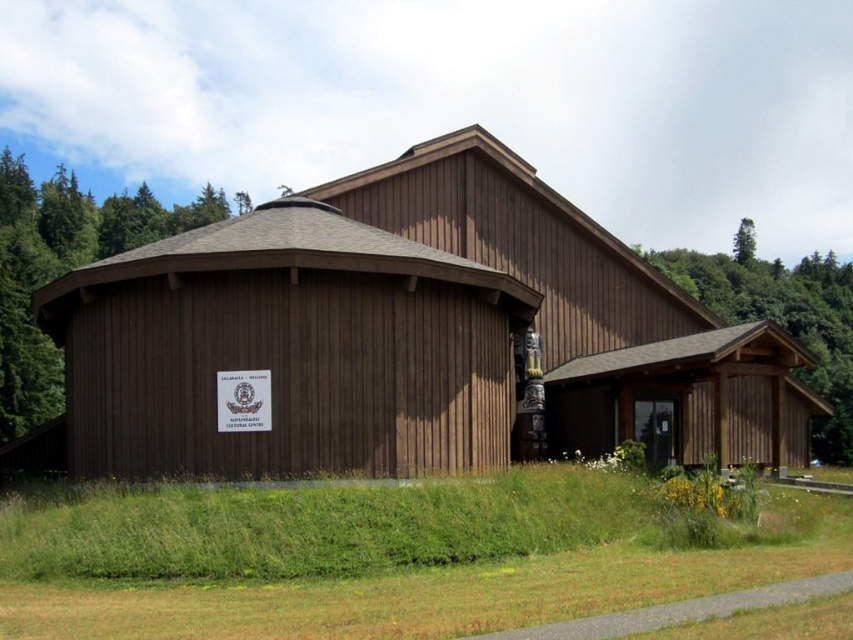
Consider the image. Who is lower down, brown wooden barn at center or green wood tree at left?

Positioned lower is brown wooden barn at center.

What do you see at coordinates (531, 298) in the screenshot?
I see `brown wooden barn at center` at bounding box center [531, 298].

Where is `brown wooden barn at center`? brown wooden barn at center is located at coordinates (531, 298).

Is brown wooden barn at center smaller than green leafy tree at upper right?

Indeed, brown wooden barn at center has a smaller size compared to green leafy tree at upper right.

Identify the location of brown wooden barn at center. pyautogui.click(x=531, y=298).

Between point (413, 216) and point (740, 248), which one is positioned behind?

Point (740, 248)

Find the location of a particular element. This screenshot has height=640, width=853. brown wooden barn at center is located at coordinates (531, 298).

Which is more to the right, green wood tree at left or green wood tree at center?

Positioned to the right is green wood tree at center.

Is point (103, 234) farther from viewer compared to point (747, 273)?

No, it is in front of (747, 273).

I want to click on green wood tree at left, so click(62, 269).